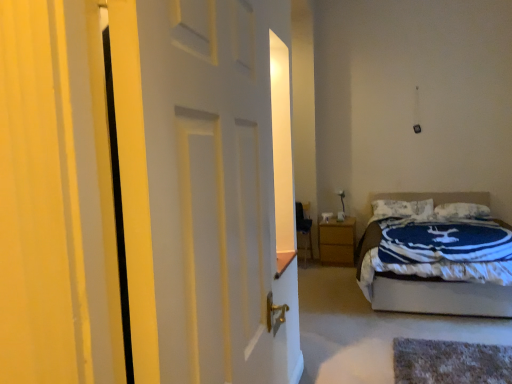
Question: From the image's perspective, is blue and white quilted bed at right under wooden nightstand at lower right?

Choices:
 (A) no
 (B) yes

Answer: (A)

Question: Is blue and white quilted bed at right far away from wooden nightstand at lower right?

Choices:
 (A) no
 (B) yes

Answer: (B)

Question: Can you confirm if blue and white quilted bed at right is smaller than wooden nightstand at lower right?

Choices:
 (A) no
 (B) yes

Answer: (A)

Question: Is blue and white quilted bed at right closer to camera compared to wooden nightstand at lower right?

Choices:
 (A) yes
 (B) no

Answer: (A)

Question: Does blue and white quilted bed at right have a greater width compared to wooden nightstand at lower right?

Choices:
 (A) no
 (B) yes

Answer: (B)

Question: From a real-world perspective, is blue and white quilted bed at right over wooden nightstand at lower right?

Choices:
 (A) yes
 (B) no

Answer: (A)

Question: Can you confirm if white soft pillow at upper center, the second pillow in the left-to-right sequence, is shorter than blue and white quilted bed at right?

Choices:
 (A) no
 (B) yes

Answer: (B)

Question: Considering the relative sizes of white soft pillow at upper center, the second pillow in the left-to-right sequence, and blue and white quilted bed at right in the image provided, is white soft pillow at upper center, the second pillow in the left-to-right sequence, wider than blue and white quilted bed at right?

Choices:
 (A) no
 (B) yes

Answer: (A)

Question: Is white soft pillow at upper center, arranged as the 1th pillow when viewed from the right, with blue and white quilted bed at right?

Choices:
 (A) yes
 (B) no

Answer: (B)

Question: Can blue and white quilted bed at right be found inside white soft pillow at upper center, arranged as the 1th pillow when viewed from the right?

Choices:
 (A) no
 (B) yes

Answer: (A)

Question: Is white soft pillow at upper center, arranged as the 1th pillow when viewed from the right, facing towards blue and white quilted bed at right?

Choices:
 (A) no
 (B) yes

Answer: (B)

Question: From the image's perspective, is white soft pillow at upper center, the second pillow in the left-to-right sequence, above blue and white quilted bed at right?

Choices:
 (A) no
 (B) yes

Answer: (B)

Question: Does white matte door at center have a smaller size compared to wooden nightstand at lower right?

Choices:
 (A) no
 (B) yes

Answer: (B)